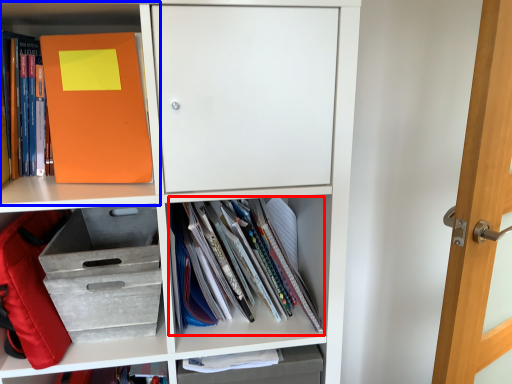
Question: Among these objects, which one is nearest to the camera, book (highlighted by a red box) or shelf (highlighted by a blue box)?

Choices:
 (A) book
 (B) shelf

Answer: (B)